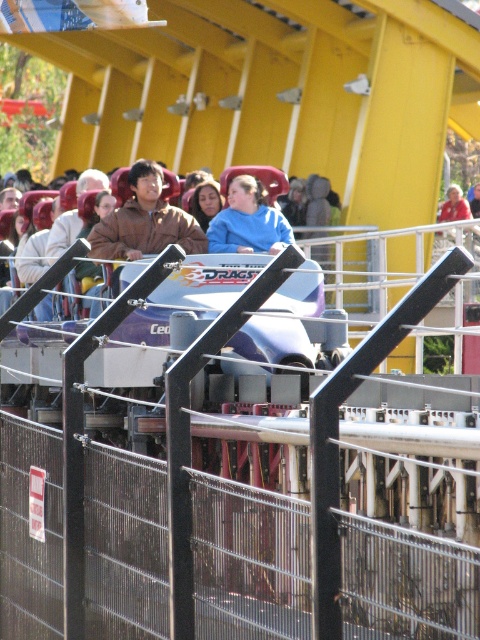
Is blue matte shirt at center bigger than red shirt at center?

Yes, blue matte shirt at center is bigger than red shirt at center.

Is blue matte shirt at center above red shirt at center?

Incorrect, blue matte shirt at center is not positioned above red shirt at center.

This screenshot has width=480, height=640. Describe the element at coordinates (248, 221) in the screenshot. I see `blue matte shirt at center` at that location.

You are a GUI agent. You are given a task and a screenshot of the screen. Output one action in this format:
    pyautogui.click(x=<x>, y=<y>)
    Task: Click on the blue matte shirt at center
    
    Given the screenshot: What is the action you would take?
    pyautogui.click(x=248, y=221)

Describe the element at coordinates (34, 252) in the screenshot. I see `brown leather jacket at center` at that location.

Is brown leather jacket at center thinner than blue matte shirt at center?

Incorrect, brown leather jacket at center's width is not less than blue matte shirt at center's.

Does point (204, 220) lie in front of point (265, 211)?

No, it is behind (265, 211).

This screenshot has width=480, height=640. Identify the location of brown leather jacket at center. (34, 252).

Is brown leather jacket at center bigger than red shirt at center?

Yes.

Does brown leather jacket at center appear on the left side of red shirt at center?

Correct, you'll find brown leather jacket at center to the left of red shirt at center.

Is point (194, 193) positioned before point (446, 192)?

Yes, it is.

Where is `brown leather jacket at center`? The image size is (480, 640). brown leather jacket at center is located at coordinates (34, 252).